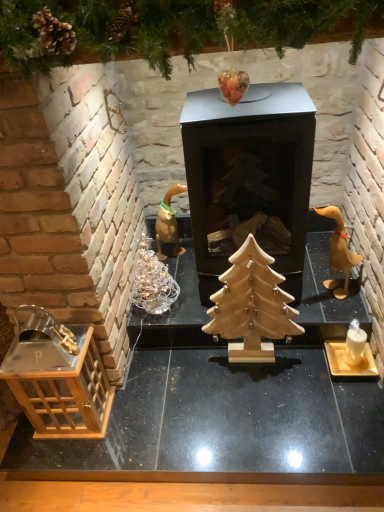
Identify the location of vacant region to the left of natural wood christmas tree at center. (194, 379).